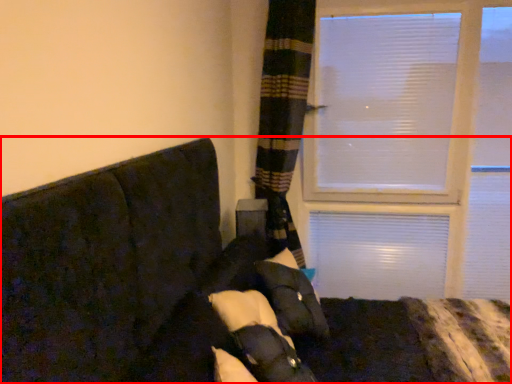
Question: From the image's perspective, where is furniture (annotated by the red box) located in relation to pillow in the image?

Choices:
 (A) below
 (B) above

Answer: (A)